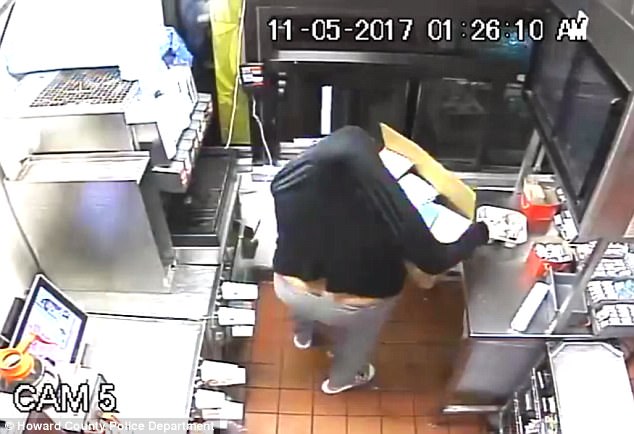
Where is `floor under counter`? floor under counter is located at coordinates (451, 313).